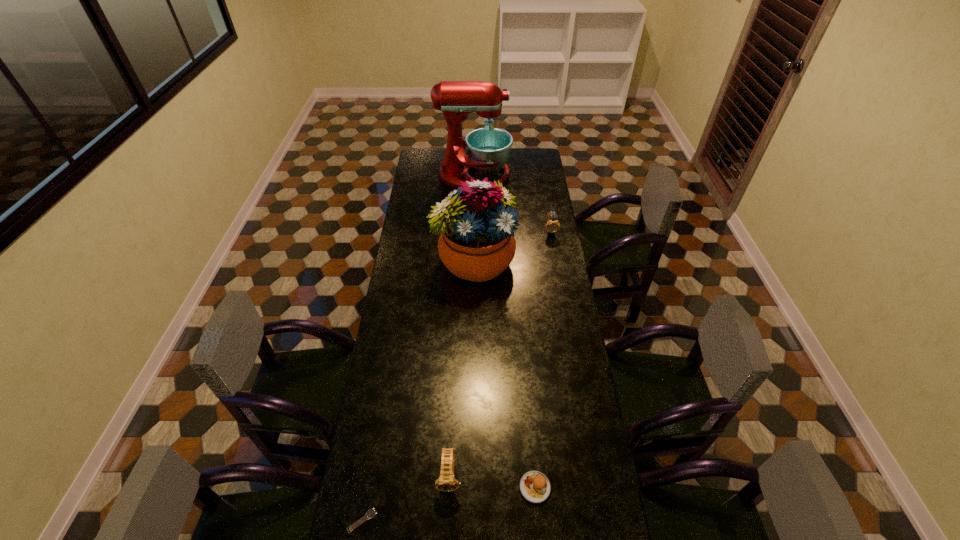
At what (x,y) coordinates should I click in order to perform the action: click on vacant space situated on the back of the flower arrangement. Please return your answer as a coordinate pair (x, y). Looking at the image, I should click on (474, 227).

Identify the location of free space located 0.320m on the face of the farthest watch. (561, 285).

Identify the location of blank space located on the face of the second nearest watch. (448, 516).

In order to click on free space located 0.200m on the left of the patty in this screenshot , I will do tap(453, 487).

Locate an element on the screen. This screenshot has height=540, width=960. vacant region located on the right of the shortest object is located at coordinates (407, 521).

Where is `object positioned at the far edge`? This screenshot has width=960, height=540. object positioned at the far edge is located at coordinates (488, 148).

The image size is (960, 540). Identify the location of mixer present at the left edge. (488, 148).

Find the location of a particular element. watch that is at the left edge is located at coordinates (371, 513).

Identify the location of object situated at the right edge. (552, 226).

This screenshot has width=960, height=540. I want to click on object at the far left corner, so click(488, 148).